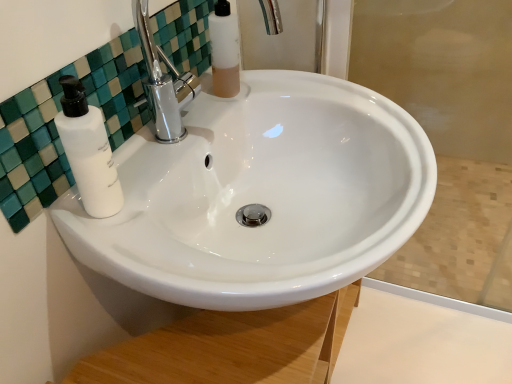
Locate an element on the screen. This screenshot has width=512, height=384. vacant point to the right of translucent plastic mouthwash at upper center is located at coordinates (306, 94).